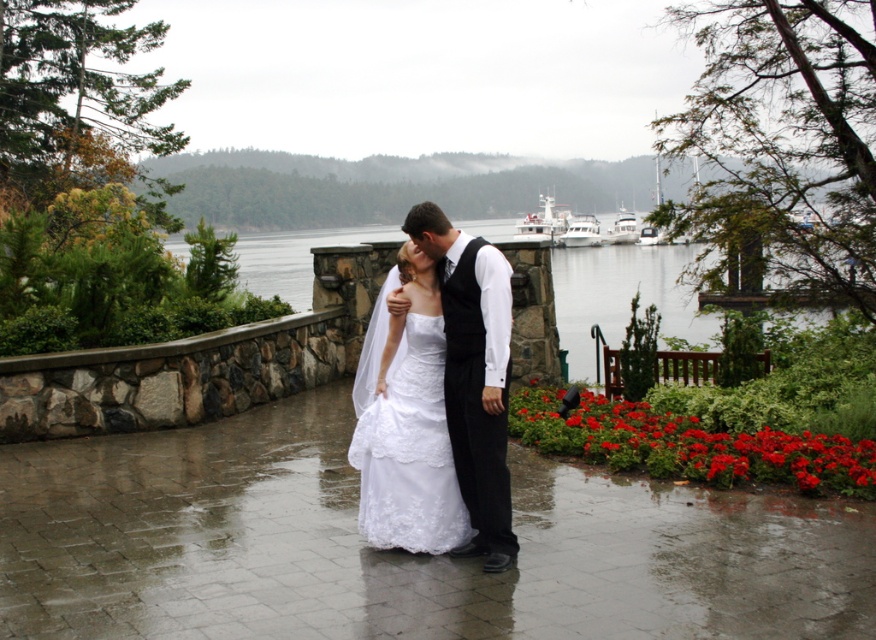
You are a photographer planning to capture the bride in her white lace dress at center and the white glossy boat at upper center in the same frame. Based on their sizes, which object would appear smaller in the photo?

The white lace dress at center would appear smaller in the photo because it has a lesser width compared to the white glossy boat at upper center.

You are a photographer who wants to capture the bride in her white lace dress at center. Based on the coordinates provided, where should you position your camera to ensure the dress is centered in the frame?

The white lace dress at center is located at coordinates point (408, 451), so you should position your camera to aim directly at that point to center the dress in the frame.

You are a photographer trying to capture the bride in her white lace dress at center. You need to position your camera at point A located at coordinates point (408, 451). Can you confirm if this point is where the white lace dress at center is located?

Yes, the point (408, 451) corresponds to the white lace dress at center, so positioning the camera there would capture the bride effectively.